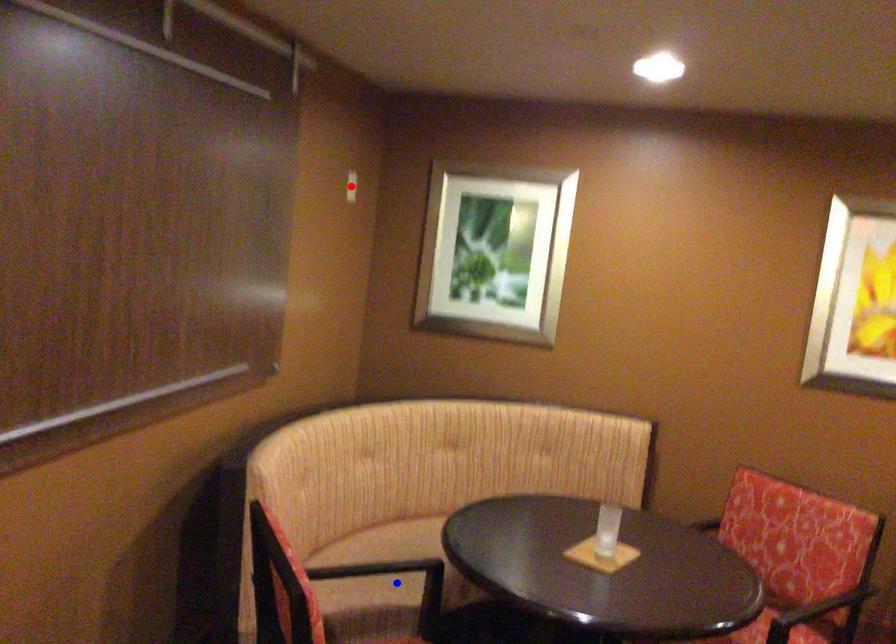
Question: Which of the two points in the image is closer to the camera?

Choices:
 (A) Blue point is closer.
 (B) Red point is closer.

Answer: (A)